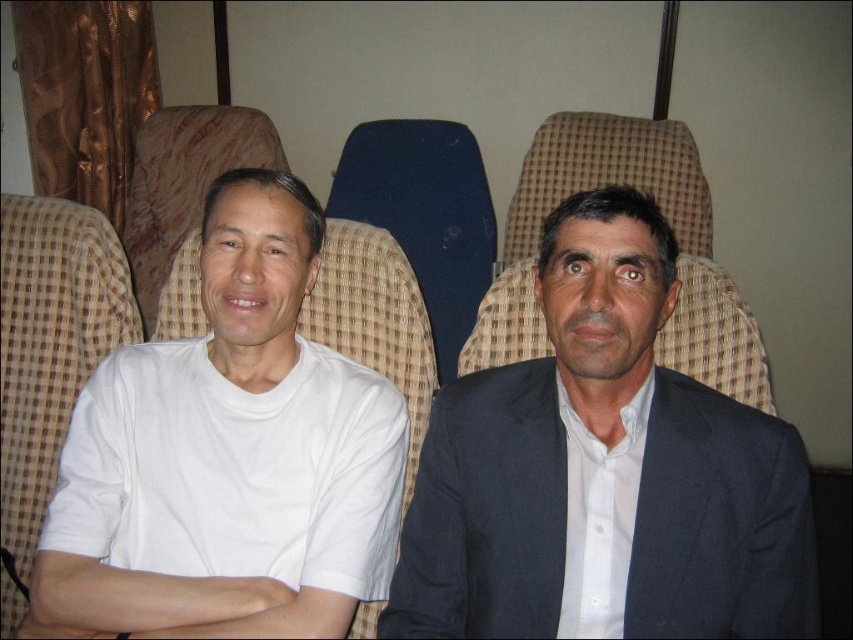
You are a passenger on a train and need to know the position of the dark blue suit at center and the beige fabric chair at left. Which one is located to the right side of the other?

The dark blue suit at center is located to the right of the beige fabric chair at left.

You are a passenger on a train and want to sit in the seat with the white fabric chair at left. The train has seats arranged in pairs facing each other. The seat you want is located at coordinate point [51,342]. If you are currently at coordinate point 0, 0, which direction should you move to reach the seat?

The point [51,342] indicates the white fabric chair at left, so you should move towards the positive x and y directions from your current position at 0, 0 to reach the seat.